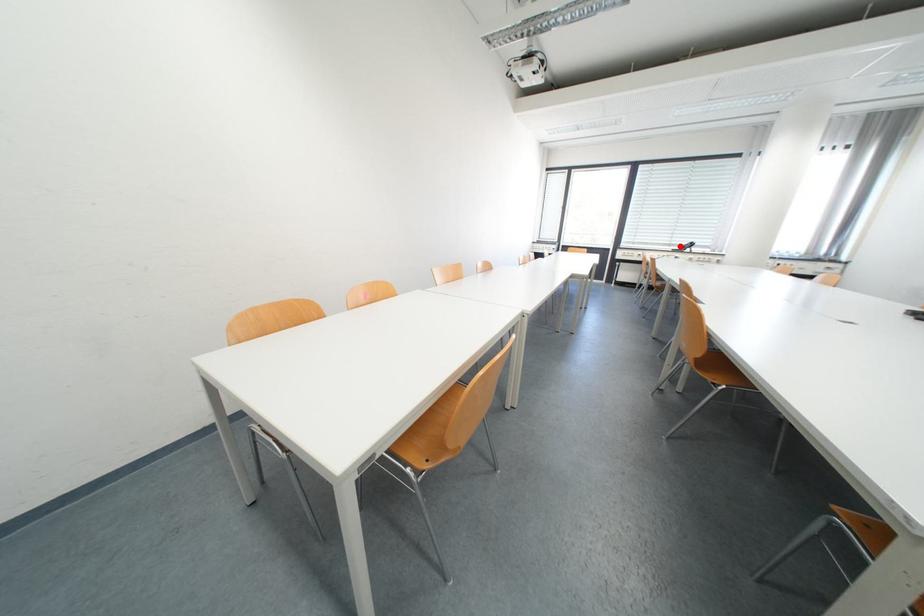
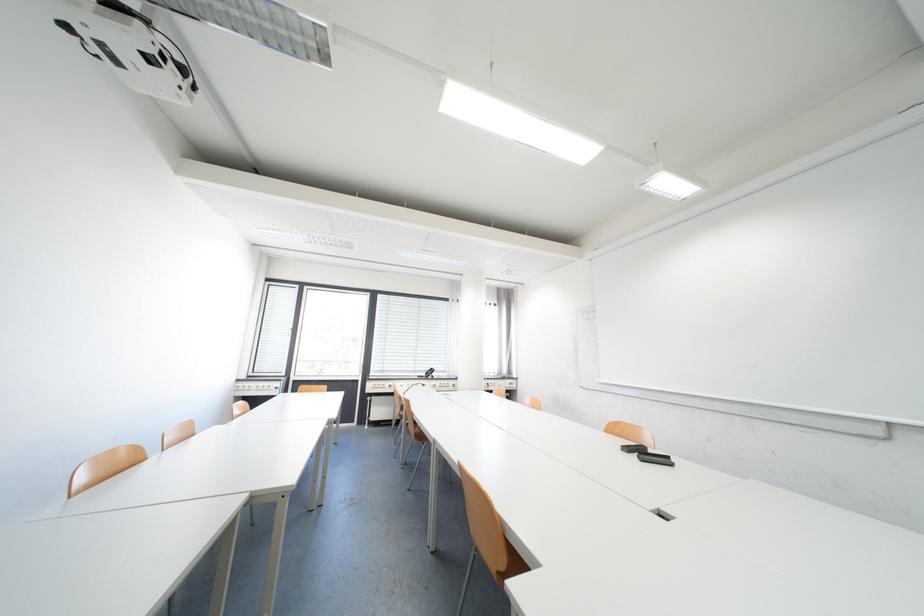
Question: I am providing you with two images of the same scene from different viewpoints. Image1 has a red point marked. In image2, the corresponding 3D location appears at what relative position? Reply with the corresponding letter.

Choices:
 (A) Closer
 (B) Farther

Answer: (B)